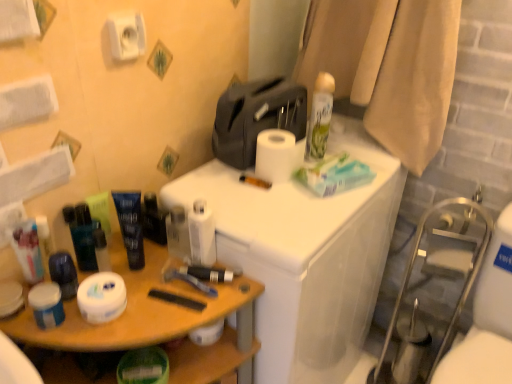
Find the location of `free space in front of matte black tube at center, which is counted as the fifth toiletry, starting from the left`. free space in front of matte black tube at center, which is counted as the fifth toiletry, starting from the left is located at coordinates (157, 289).